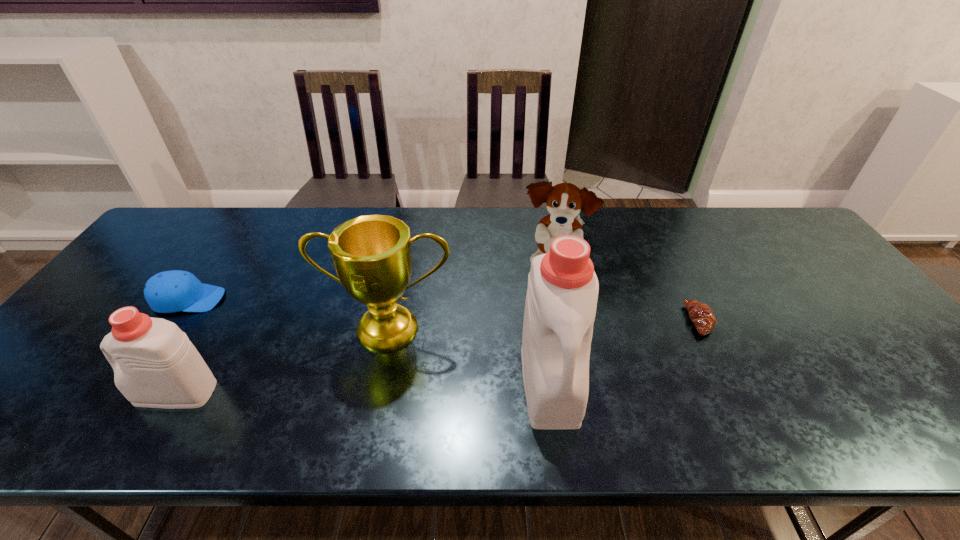
The width and height of the screenshot is (960, 540). In the image, there is a desktop. In order to click on free space at the far left corner in this screenshot , I will do `click(195, 239)`.

Identify the location of free spot at the far right corner of the desktop. The width and height of the screenshot is (960, 540). (787, 245).

Locate an element on the screen. The image size is (960, 540). empty space that is in between the second shortest object and the crescent roll is located at coordinates (444, 310).

At what (x,y) coordinates should I click in order to perform the action: click on vacant area between the puppy and the rightmost object. Please return your answer as a coordinate pair (x, y). Looking at the image, I should click on (627, 293).

You are a GUI agent. You are given a task and a screenshot of the screen. Output one action in this format:
    pyautogui.click(x=<x>, y=<y>)
    Task: Click on the free space between the puppy and the fourth object from right to left
    This screenshot has height=540, width=960.
    Given the screenshot: What is the action you would take?
    pyautogui.click(x=471, y=296)

The image size is (960, 540). Find the location of `free spot between the shortest object and the cap`. free spot between the shortest object and the cap is located at coordinates (444, 310).

This screenshot has height=540, width=960. I want to click on vacant area that lies between the taller detergent and the shorter detergent, so click(363, 387).

Identify the location of empty space that is in between the taller detergent and the award. Image resolution: width=960 pixels, height=540 pixels. (469, 355).

Where is `unoccupied area between the shorter detergent and the crescent roll`? This screenshot has height=540, width=960. unoccupied area between the shorter detergent and the crescent roll is located at coordinates (438, 356).

I want to click on free point between the left detergent and the award, so click(x=283, y=360).